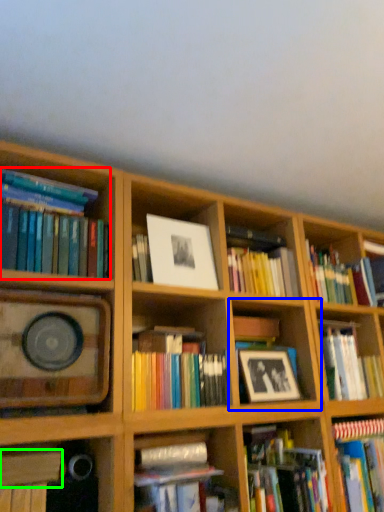
Question: Which object is the closest to the book (highlighted by a red box)? Choose among these: shelf (highlighted by a blue box) or book (highlighted by a green box).

Choices:
 (A) shelf
 (B) book

Answer: (B)